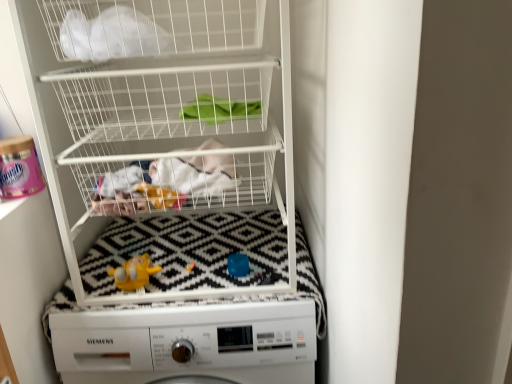
Identify the location of vacant space behind yellow rubber duck at center. This screenshot has height=384, width=512. (147, 254).